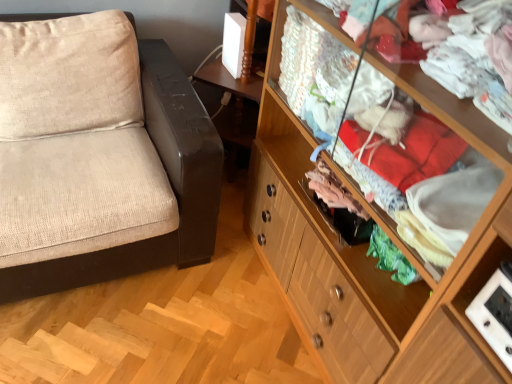
This screenshot has height=384, width=512. Identify the location of wooden cabinet at right. (365, 248).

Describe the element at coordinates (365, 248) in the screenshot. I see `wooden cabinet at right` at that location.

Find the location of `wooden cabinet at right`. wooden cabinet at right is located at coordinates (365, 248).